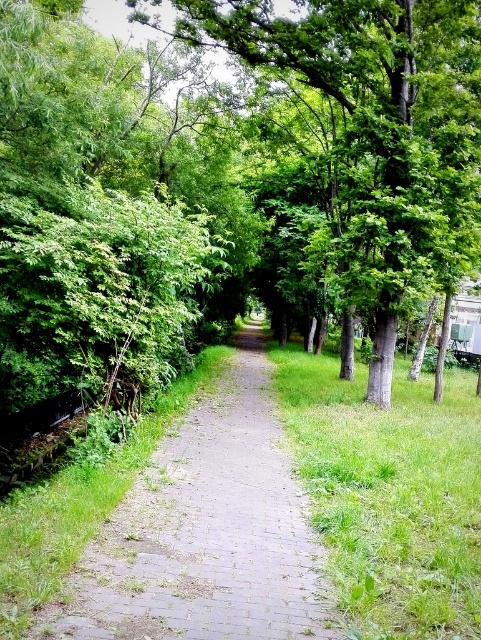
Between green leafy tree at center and gray brick path at center, which one is positioned lower?

gray brick path at center is lower down.

Describe the element at coordinates (379, 134) in the screenshot. I see `green leafy tree at center` at that location.

Where is `green leafy tree at center`? The height and width of the screenshot is (640, 481). green leafy tree at center is located at coordinates (379, 134).